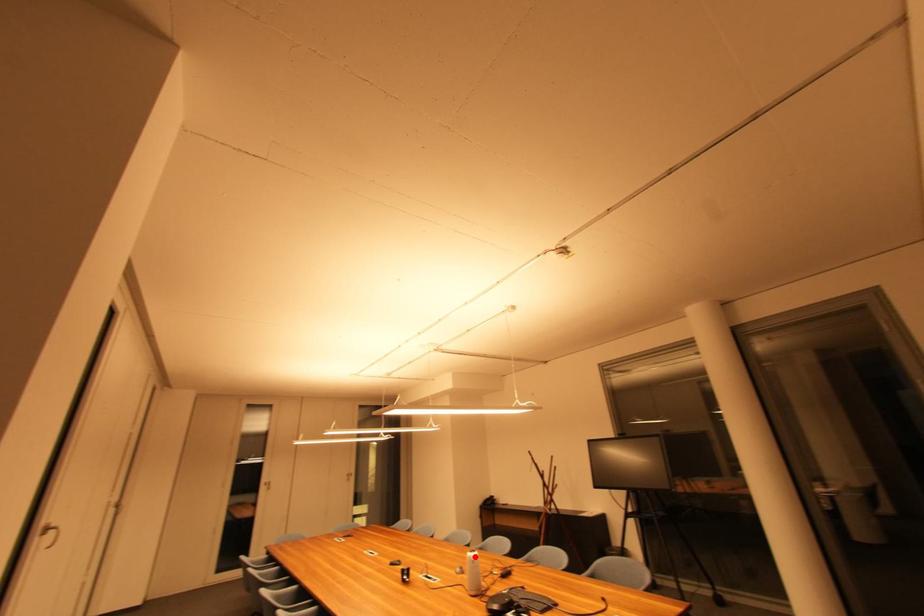
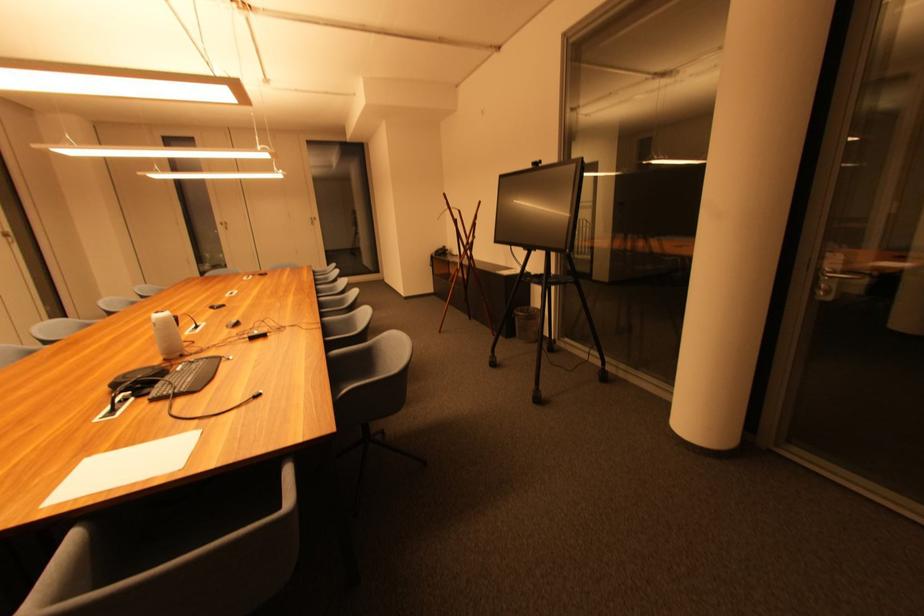
Find the pixel in the second image that matches the highlighted location in the first image.

(160, 318)